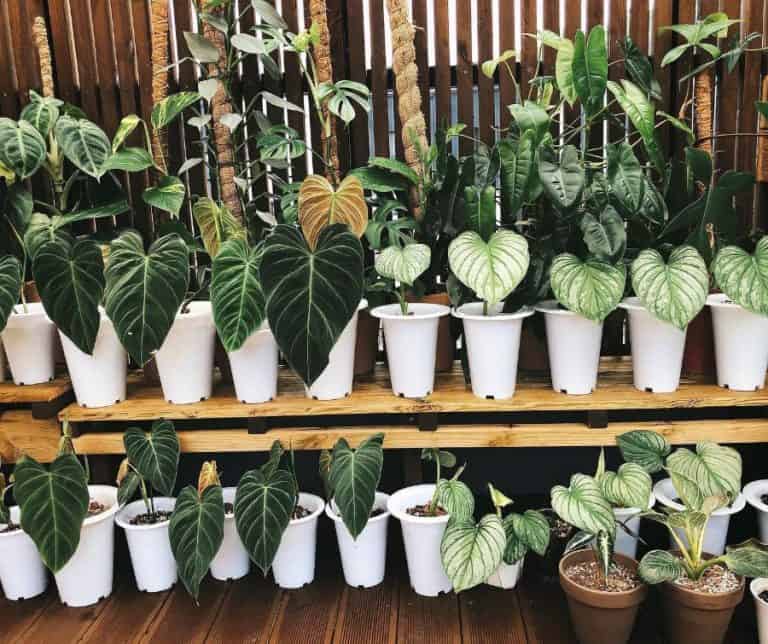
The width and height of the screenshot is (768, 644). I want to click on pot, so click(x=495, y=365).